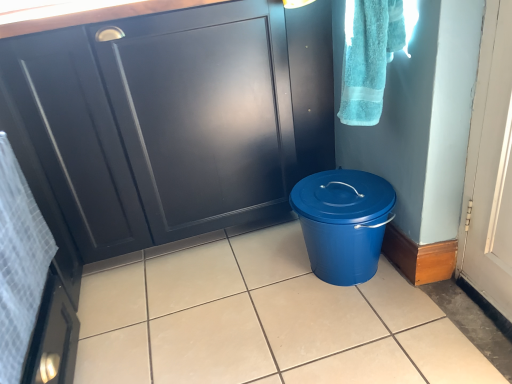
Locate an element on the screen. The width and height of the screenshot is (512, 384). free spot in front of blue plastic bucket at lower right is located at coordinates (370, 332).